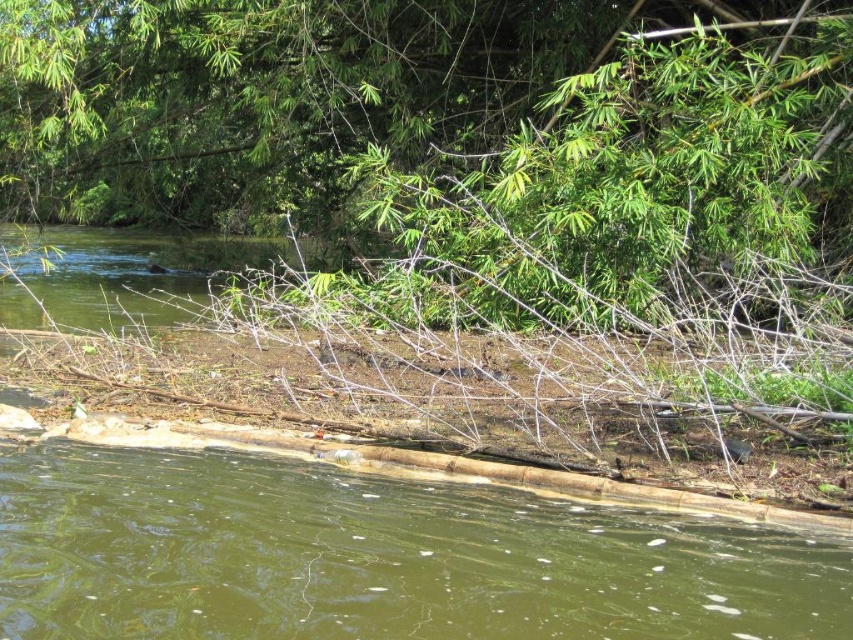
Can you confirm if brown wood log at lower center is smaller than green leafy tree at upper center?

Indeed, brown wood log at lower center has a smaller size compared to green leafy tree at upper center.

Is brown wood log at lower center thinner than green leafy tree at upper center?

Correct, brown wood log at lower center's width is less than green leafy tree at upper center's.

What do you see at coordinates (378, 557) in the screenshot?
I see `brown wood log at lower center` at bounding box center [378, 557].

You are a GUI agent. You are given a task and a screenshot of the screen. Output one action in this format:
    pyautogui.click(x=<x>, y=<y>)
    Task: Click on the brown wood log at lower center
    
    Given the screenshot: What is the action you would take?
    pyautogui.click(x=378, y=557)

Can you confirm if green leafy tree at upper center is wider than green leafy water at center?

Yes.

Between point (186, 145) and point (125, 314), which one is positioned in front?

Point (125, 314) is more forward.

Locate an element on the screen. The width and height of the screenshot is (853, 640). green leafy tree at upper center is located at coordinates (283, 96).

Which is below, brown wood log at lower center or green leafy water at center?

brown wood log at lower center

Who is more distant from viewer, (448, 636) or (39, 260)?

The point (39, 260) is behind.

Locate an element on the screen. The height and width of the screenshot is (640, 853). brown wood log at lower center is located at coordinates (378, 557).